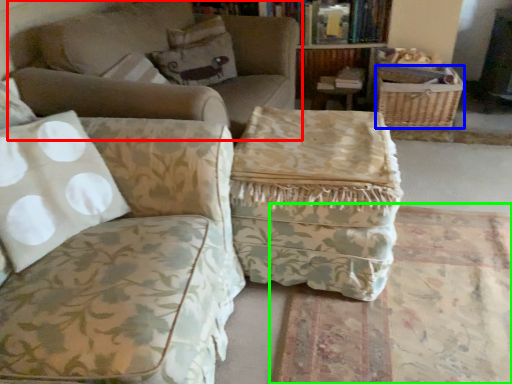
Question: Estimate the real-world distances between objects in this image. Which object is closer to studio couch (highlighted by a red box), basket (highlighted by a blue box) or mat (highlighted by a green box)?

Choices:
 (A) basket
 (B) mat

Answer: (B)